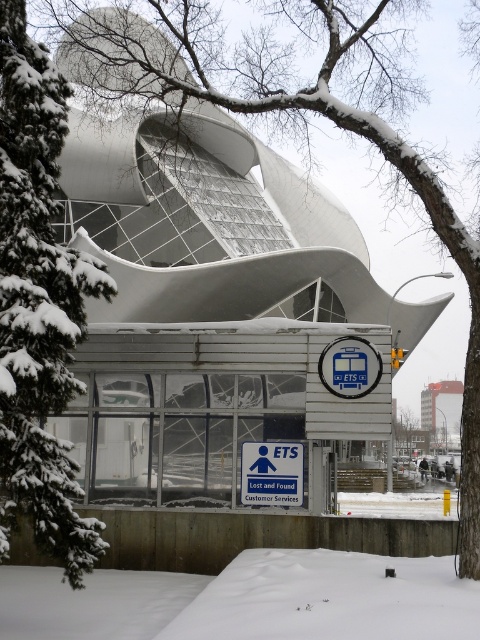
Can you confirm if green snow-covered evergreen at left is positioned to the left of white fluffy snow at lower center?

Correct, you'll find green snow-covered evergreen at left to the left of white fluffy snow at lower center.

Identify the location of green snow-covered evergreen at left. The image size is (480, 640). (38, 307).

Measure the distance between green snow-covered evergreen at left and camera.

green snow-covered evergreen at left and camera are 11.88 meters apart.

This screenshot has height=640, width=480. In order to click on green snow-covered evergreen at left in this screenshot , I will do `click(38, 307)`.

Consider the image. Is green snow-covered evergreen at left closer to the viewer compared to red brick building at center?

Yes, green snow-covered evergreen at left is in front of red brick building at center.

Who is more forward, (63, 540) or (421, 420)?

Point (63, 540) is in front.

Identify the location of green snow-covered evergreen at left. (38, 307).

Which is above, white fluffy snow at lower center or blue plastic sign at center?

blue plastic sign at center is above.

Between white fluffy snow at lower center and blue plastic sign at center, which one has less height?

With less height is blue plastic sign at center.

In order to click on white fluffy snow at lower center in this screenshot , I will do `click(248, 600)`.